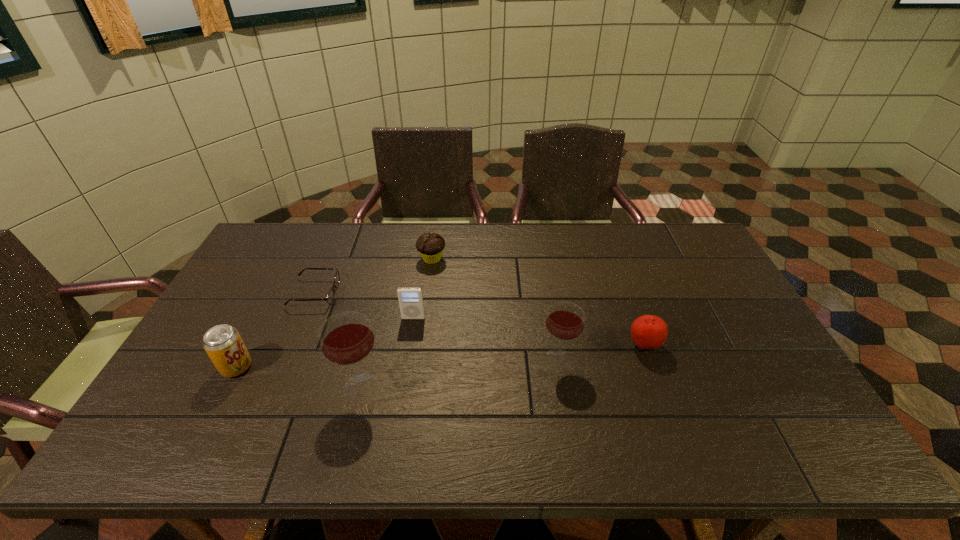
At what (x,y) coordinates should I click in order to perform the action: click on the fifth object from right to left. Please return your answer as a coordinate pair (x, y). The height and width of the screenshot is (540, 960). Looking at the image, I should click on (346, 338).

The height and width of the screenshot is (540, 960). Identify the location of the taller wineglass. (346, 338).

The width and height of the screenshot is (960, 540). I want to click on the sixth shortest object, so click(565, 320).

Find the location of a particular element. The image size is (960, 540). the shorter wineglass is located at coordinates (565, 320).

Locate an element on the screen. The image size is (960, 540). the third farthest object is located at coordinates (411, 303).

Where is `muffin`? muffin is located at coordinates (430, 246).

Identify the location of pop (soda). The height and width of the screenshot is (540, 960). (223, 344).

Where is `the second farthest object`? the second farthest object is located at coordinates (330, 297).

This screenshot has height=540, width=960. In order to click on the shortest object in this screenshot , I will do `click(330, 297)`.

You are a GUI agent. You are given a task and a screenshot of the screen. Output one action in this format:
    pyautogui.click(x=<x>, y=<y>)
    Task: Click on the apple
    
    Given the screenshot: What is the action you would take?
    pyautogui.click(x=649, y=332)